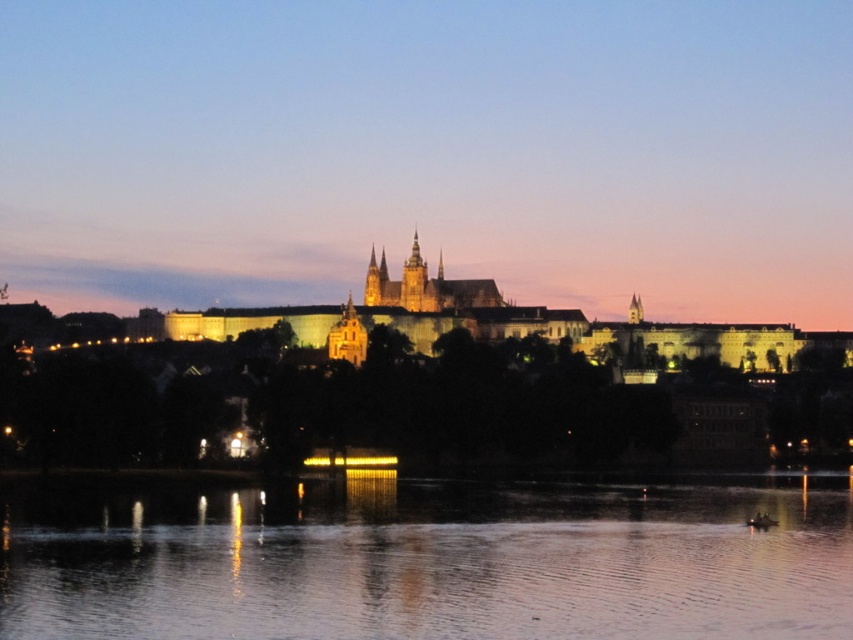
Looking at this image, you are standing in front of the castle and want to take a photo of its reflection in the water. Where exactly should you position yourself to capture the reflection of the smooth reflective water at lower center?

You should position yourself at point [425,563] to capture the reflection of the smooth reflective water at lower center.

You are an architect analyzing the scene. You need to determine if the smooth reflective water at lower center can be seen above the illuminated stone castle at center. Based on the scene description, can you confirm this?

The smooth reflective water at lower center is not as tall as the illuminated stone castle at center, so it cannot be seen above the illuminated stone castle at center.

You are a tourist standing at the edge of the smooth reflective water at lower center, and you want to take a photo of the illuminated stone castle at center. If your camera has a maximum zoom range of 100 meters, will you be able to capture the entire castle in the photo without moving closer?

The smooth reflective water at lower center is 128.10 meters away from the illuminated stone castle at center. Since the camera can only zoom up to 100 meters, you won not be able to capture the entire castle in the photo without moving closer.